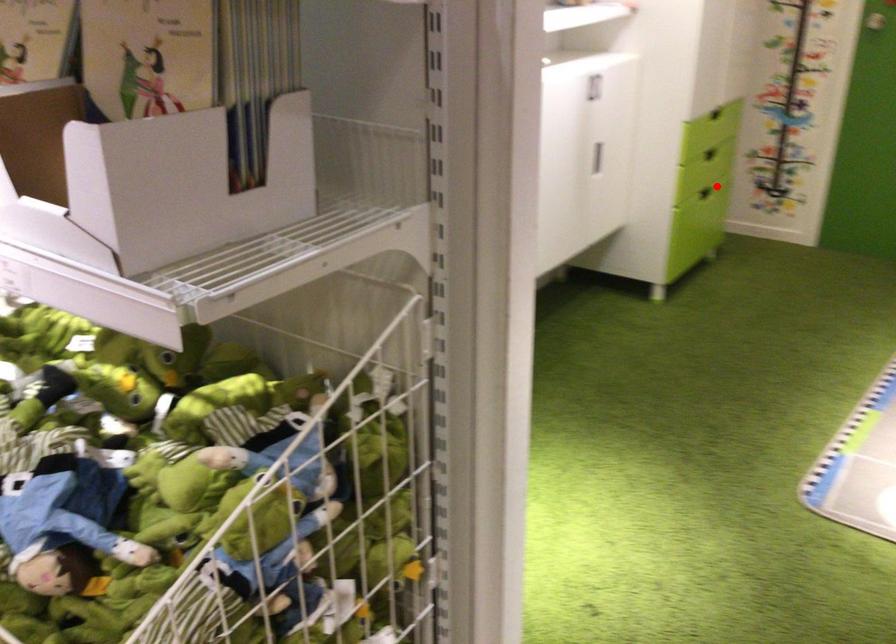
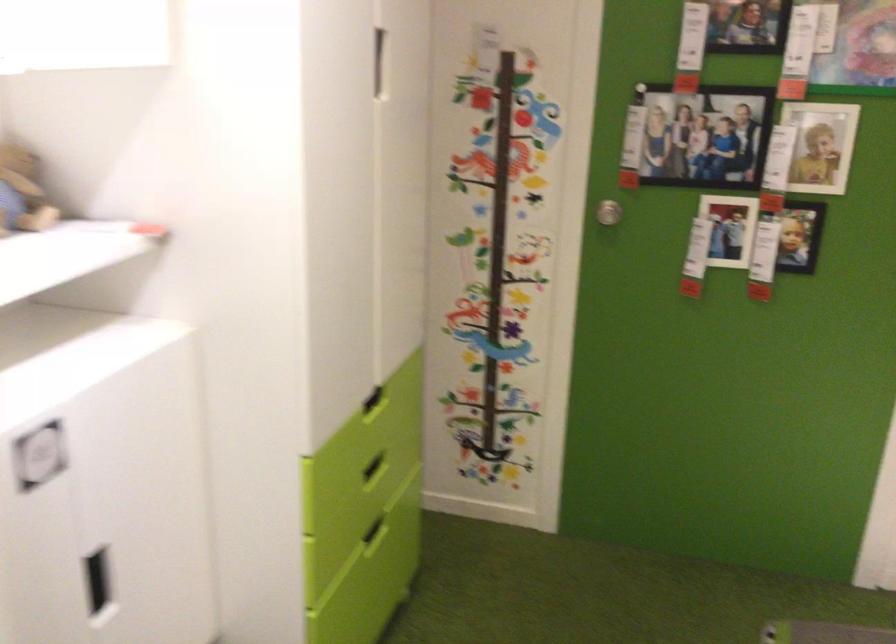
Question: I am providing you with two images of the same scene from different viewpoints. In image1, a red point is highlighted. Considering the same 3D point in image2, which of the following is correct?

Choices:
 (A) It is closer
 (B) It is farther

Answer: (A)